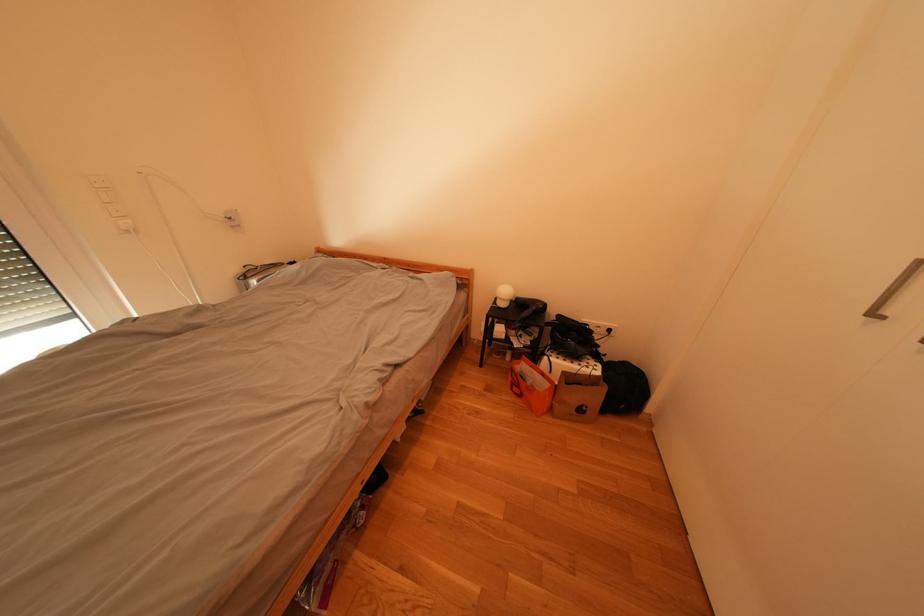
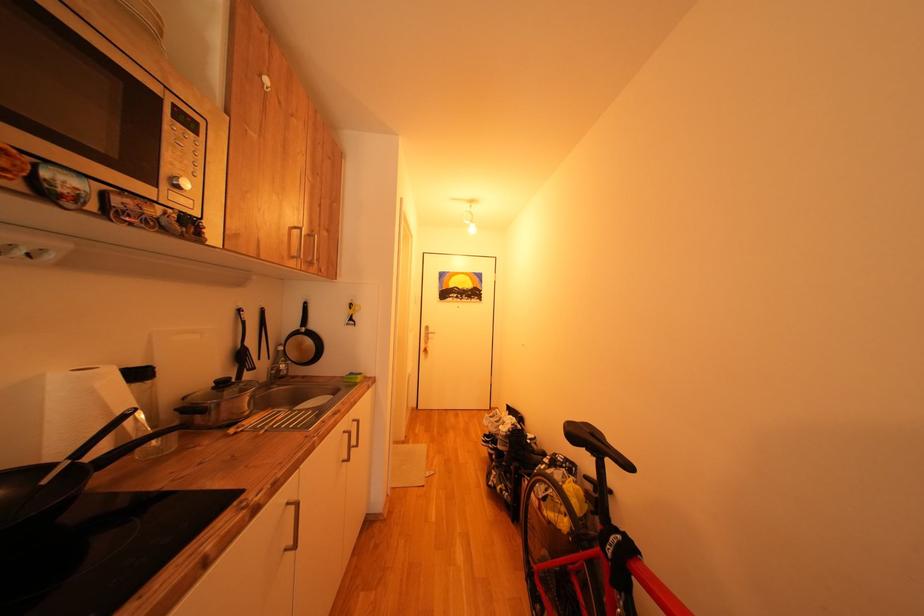
Question: The first image is from the beginning of the video and the second image is from the end. How did the camera likely rotate when shooting the video?

Choices:
 (A) Left
 (B) Right
 (C) Up
 (D) Down

Answer: (B)